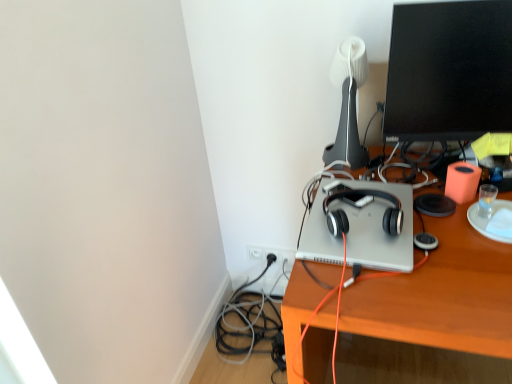
This screenshot has width=512, height=384. In order to click on vacant space in satin black headphones at center (from a real-world perspective) in this screenshot , I will do `click(365, 215)`.